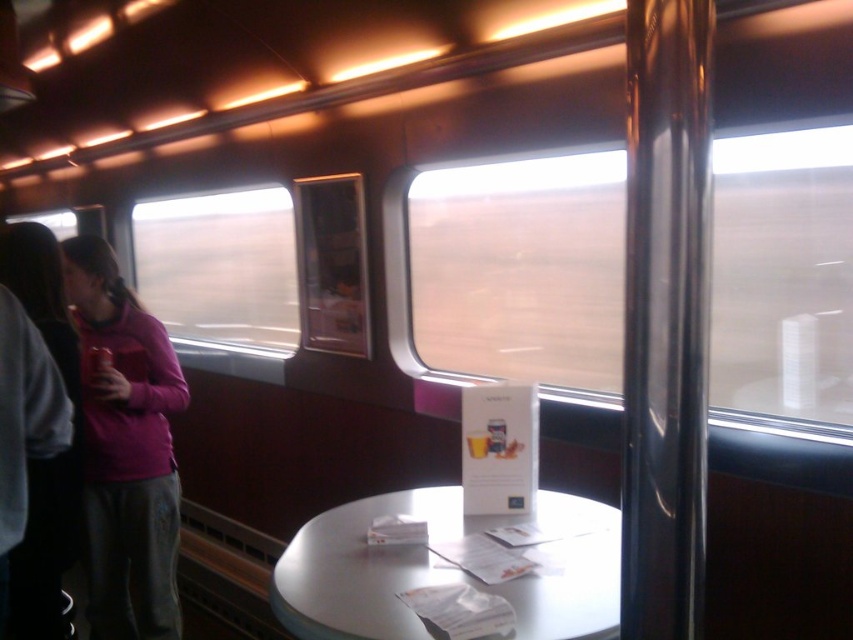
Question: Considering the relative positions of pink fleece jacket at left and metallic can at left in the image provided, where is pink fleece jacket at left located with respect to metallic can at left?

Choices:
 (A) left
 (B) right

Answer: (B)

Question: Is clear glass window at center above metallic can at left?

Choices:
 (A) yes
 (B) no

Answer: (A)

Question: Can you confirm if clear glass window at center is wider than pink fleece jacket at left?

Choices:
 (A) no
 (B) yes

Answer: (B)

Question: Which of the following is the closest to the observer?

Choices:
 (A) pink fleece jacket at left
 (B) metallic can at left
 (C) white glossy table at center
 (D) clear glass window at center

Answer: (C)

Question: Which object is positioned farthest from the metallic can at left?

Choices:
 (A) white glossy table at center
 (B) clear glass window at center
 (C) pink fleece jacket at left
 (D) transparent glass window at left

Answer: (D)

Question: Which of the following is the closest to the observer?

Choices:
 (A) (97, 346)
 (B) (850, 360)
 (C) (80, 308)
 (D) (167, 289)

Answer: (B)